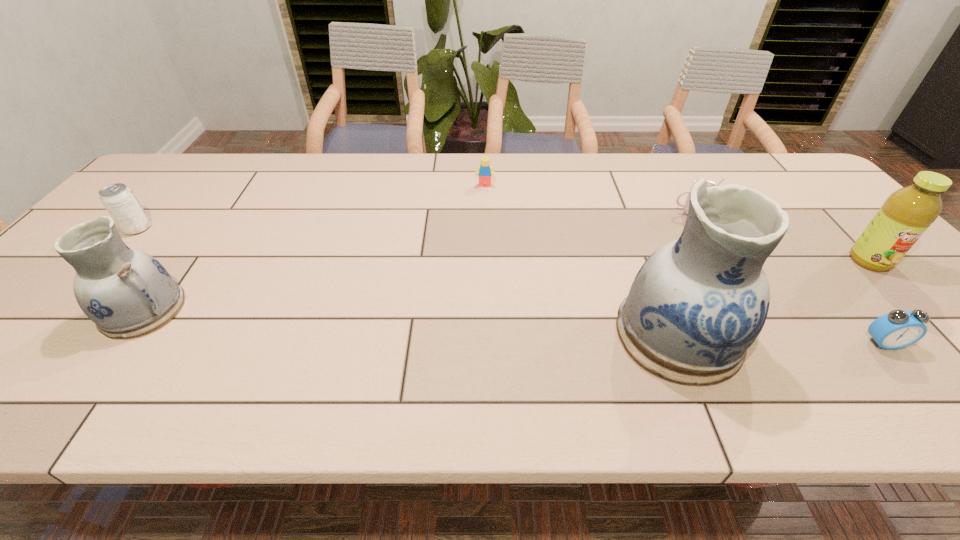
Choose which object is the sixth nearest neighbor to the Lego. Please provide its 2D coordinates. Your answer should be formatted as a tuple, i.e. [(x, y)], where the tuple contains the x and y coordinates of a point satisfying the conditions above.

[(897, 329)]

What are the coordinates of `vacant space that satisfies the following two spatial constraints: 1. on the front side of the right pottery; 2. on the right side of the soda can` in the screenshot? It's located at (42, 334).